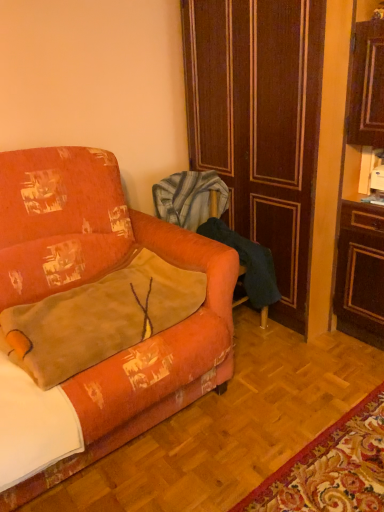
Question: Is the position of velvet orange armchair at center more distant than that of orange fabric couch at left?

Choices:
 (A) yes
 (B) no

Answer: (A)

Question: From the image's perspective, does velvet orange armchair at center appear higher than orange fabric couch at left?

Choices:
 (A) yes
 (B) no

Answer: (A)

Question: Considering the relative sizes of velvet orange armchair at center and orange fabric couch at left in the image provided, is velvet orange armchair at center taller than orange fabric couch at left?

Choices:
 (A) no
 (B) yes

Answer: (A)

Question: Considering the relative sizes of velvet orange armchair at center and orange fabric couch at left in the image provided, is velvet orange armchair at center shorter than orange fabric couch at left?

Choices:
 (A) yes
 (B) no

Answer: (A)

Question: Is velvet orange armchair at center not inside orange fabric couch at left?

Choices:
 (A) yes
 (B) no

Answer: (A)

Question: Is velvet orange armchair at center aimed at orange fabric couch at left?

Choices:
 (A) yes
 (B) no

Answer: (B)

Question: Does orange fabric couch at left appear on the right side of velvet orange armchair at center?

Choices:
 (A) no
 (B) yes

Answer: (A)

Question: Considering the relative sizes of orange fabric couch at left and velvet orange armchair at center in the image provided, is orange fabric couch at left smaller than velvet orange armchair at center?

Choices:
 (A) yes
 (B) no

Answer: (B)

Question: Is orange fabric couch at left facing away from velvet orange armchair at center?

Choices:
 (A) yes
 (B) no

Answer: (B)

Question: Would you say velvet orange armchair at center is part of orange fabric couch at left's contents?

Choices:
 (A) no
 (B) yes

Answer: (A)

Question: Is orange fabric couch at left in front of velvet orange armchair at center?

Choices:
 (A) yes
 (B) no

Answer: (A)

Question: From a real-world perspective, is orange fabric couch at left located beneath velvet orange armchair at center?

Choices:
 (A) yes
 (B) no

Answer: (B)

Question: Considering the relative sizes of velvet orange armchair at center and velvet orange throw pillow at lower left in the image provided, is velvet orange armchair at center smaller than velvet orange throw pillow at lower left?

Choices:
 (A) yes
 (B) no

Answer: (B)